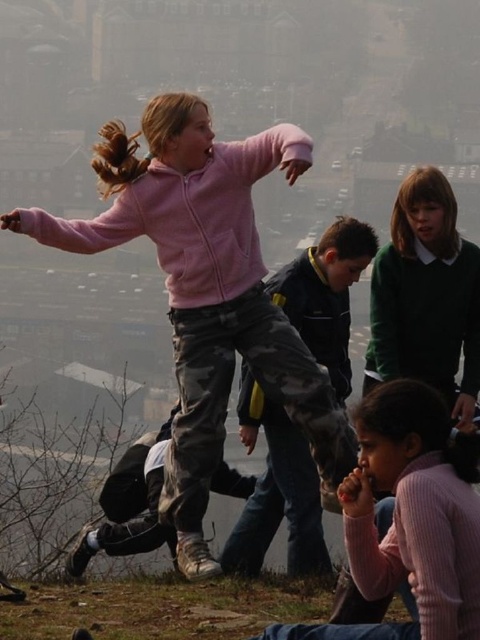
Question: Is matte pink hoodie at upper left to the right of pink ribbed sweater at lower right from the viewer's perspective?

Choices:
 (A) yes
 (B) no

Answer: (B)

Question: Which point is farther to the camera?

Choices:
 (A) (334, 630)
 (B) (214, 330)

Answer: (B)

Question: Does matte pink hoodie at upper left have a smaller size compared to pink ribbed sweater at lower right?

Choices:
 (A) no
 (B) yes

Answer: (A)

Question: Considering the relative positions of matte pink hoodie at upper left and pink ribbed sweater at lower right in the image provided, where is matte pink hoodie at upper left located with respect to pink ribbed sweater at lower right?

Choices:
 (A) left
 (B) right

Answer: (A)

Question: Which of the following is the closest to the observer?

Choices:
 (A) pink ribbed sweater at lower right
 (B) matte pink hoodie at upper left

Answer: (A)